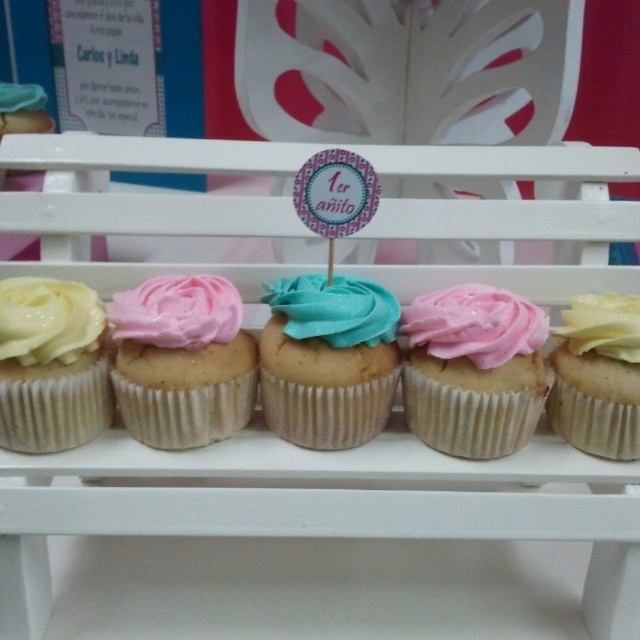
Who is positioned more to the right, teal frosting cupcake at center or white glossy frosting at left?

Positioned to the right is teal frosting cupcake at center.

Which is above, teal frosting cupcake at center or white glossy frosting at left?

white glossy frosting at left

Which is behind, point (312, 420) or point (22, 314)?

The point (312, 420) is behind.

You are a GUI agent. You are given a task and a screenshot of the screen. Output one action in this format:
    pyautogui.click(x=<x>, y=<y>)
    Task: Click on the teal frosting cupcake at center
    
    Given the screenshot: What is the action you would take?
    pyautogui.click(x=328, y=360)

Looking at this image, does pink glossy frosting at center appear under teal glossy icing at center?

Yes.

Does pink glossy frosting at center have a greater width compared to teal glossy icing at center?

Correct, the width of pink glossy frosting at center exceeds that of teal glossy icing at center.

Is point (429, 355) less distant than point (284, 310)?

That is True.

Identify the location of pink glossy frosting at center. (474, 324).

Who is positioned more to the left, pink glossy cupcake at center or white glossy frosting at left?

white glossy frosting at left is more to the left.

Is pink glossy cupcake at center thinner than white glossy frosting at left?

No.

Where is `pink glossy cupcake at center`? This screenshot has height=640, width=640. pink glossy cupcake at center is located at coordinates (474, 371).